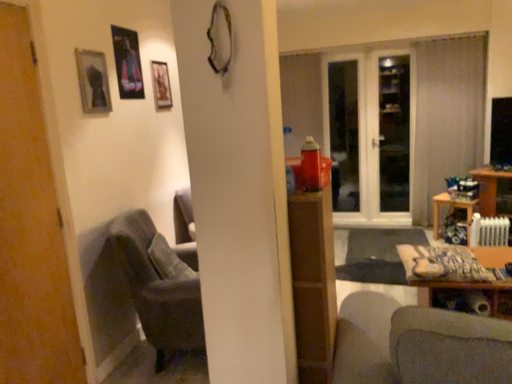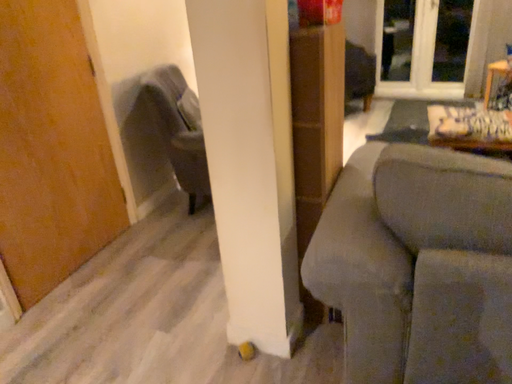
Question: How did the camera likely rotate when shooting the video?

Choices:
 (A) rotated upward
 (B) rotated downward

Answer: (B)